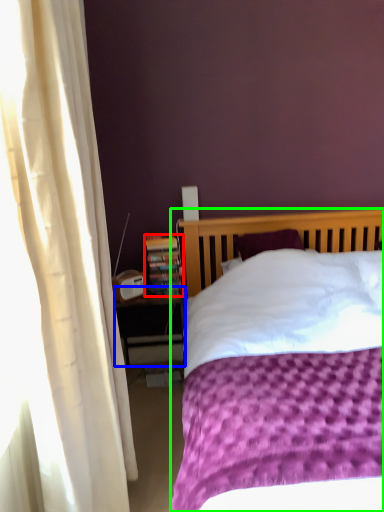
Question: Which object is positioned closest to paperback book (highlighted by a red box)? Select from nightstand (highlighted by a blue box) and bed (highlighted by a green box).

Choices:
 (A) nightstand
 (B) bed

Answer: (A)